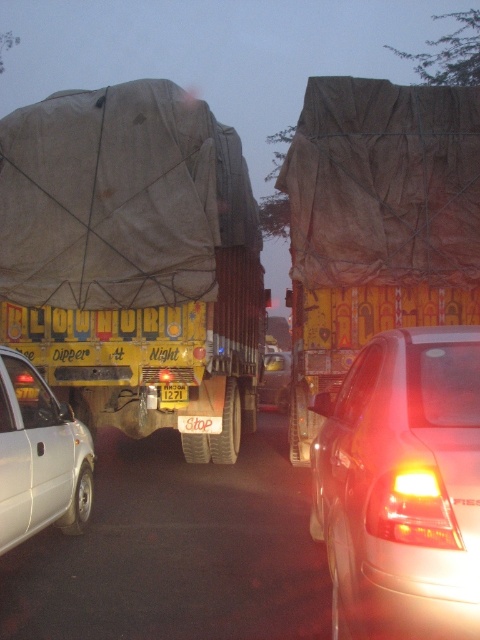
Is white glossy sedan at lower right taller than yellow matte license plate at center?

Yes.

Can you confirm if white glossy sedan at lower right is thinner than yellow matte license plate at center?

No, white glossy sedan at lower right is not thinner than yellow matte license plate at center.

Identify the location of white glossy sedan at lower right. This screenshot has height=640, width=480. (402, 484).

Does brown tarpaulin truck at center appear under yellow matte license plate at center?

Actually, brown tarpaulin truck at center is above yellow matte license plate at center.

Which of these two, brown tarpaulin truck at center or yellow matte license plate at center, stands shorter?

Standing shorter between the two is yellow matte license plate at center.

What are the coordinates of `brown tarpaulin truck at center` in the screenshot? It's located at (376, 224).

You are a GUI agent. You are given a task and a screenshot of the screen. Output one action in this format:
    pyautogui.click(x=<x>, y=<y>)
    Task: Click on the brown tarpaulin truck at center
    The width and height of the screenshot is (480, 640).
    Given the screenshot: What is the action you would take?
    pyautogui.click(x=376, y=224)

Is yellow painted steel truck at center positioned behind brown tarpaulin truck at center?

Yes, yellow painted steel truck at center is behind brown tarpaulin truck at center.

How much distance is there between yellow painted steel truck at center and brown tarpaulin truck at center?

yellow painted steel truck at center and brown tarpaulin truck at center are 1.48 meters apart from each other.

Does point (157, 406) come closer to viewer compared to point (316, 100)?

No, it is behind (316, 100).

Find the location of a particular element. The image size is (480, 640). yellow painted steel truck at center is located at coordinates (133, 260).